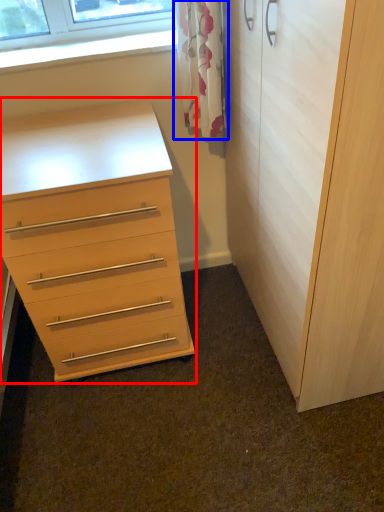
Question: Which object is further to the camera taking this photo, chest of drawers (highlighted by a red box) or curtain (highlighted by a blue box)?

Choices:
 (A) chest of drawers
 (B) curtain

Answer: (B)